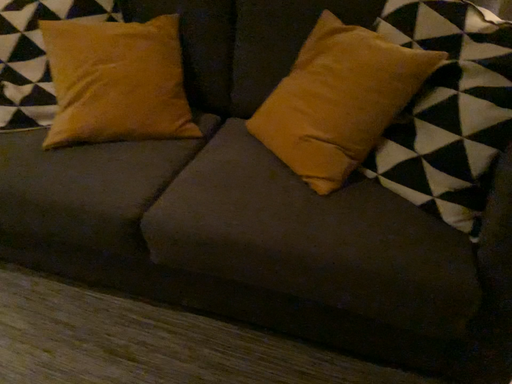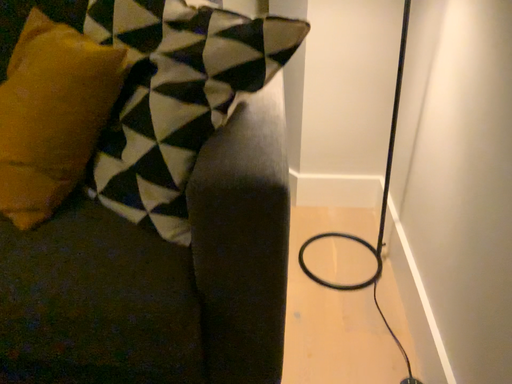
Question: Which way did the camera rotate in the video?

Choices:
 (A) rotated left
 (B) rotated right

Answer: (B)